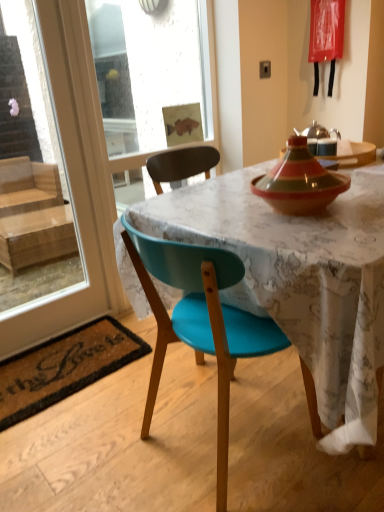
This screenshot has height=512, width=384. Find the location of `free space in front of transparent glass screen door at upper left`. free space in front of transparent glass screen door at upper left is located at coordinates (141, 407).